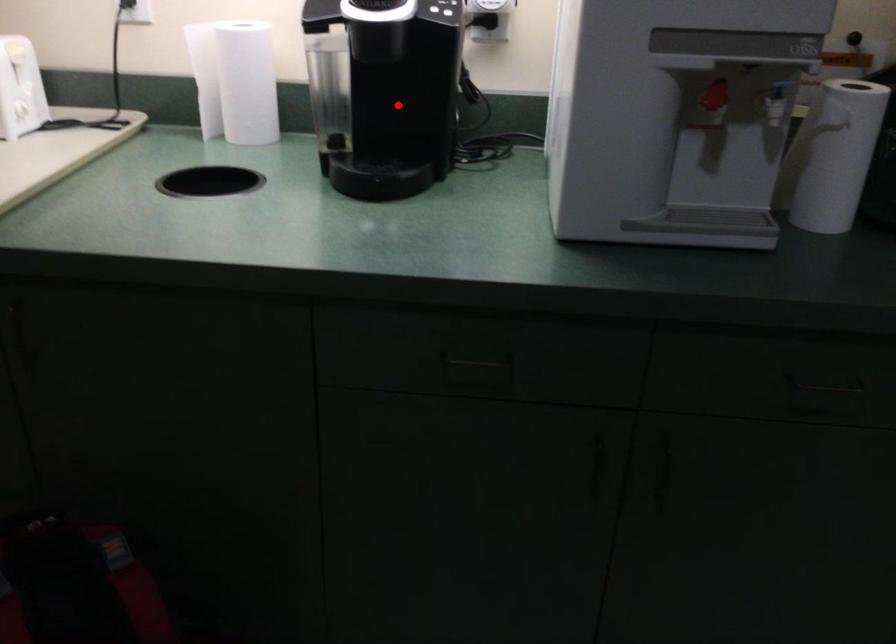
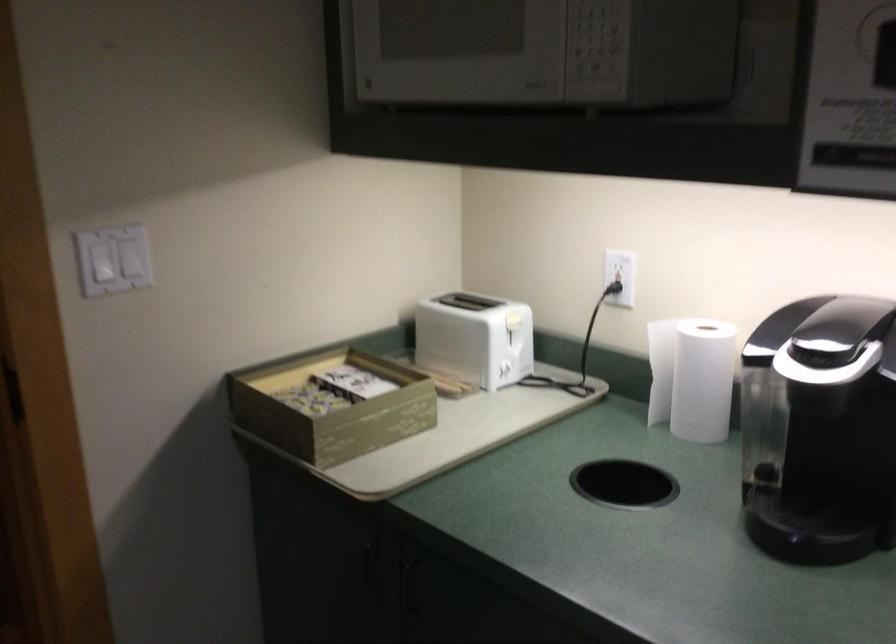
Question: I am providing you with two images of the same scene from different viewpoints. Given a red point in image1, look at the same physical point in image2. Is it:

Choices:
 (A) Closer to the viewpoint
 (B) Farther from the viewpoint

Answer: (A)